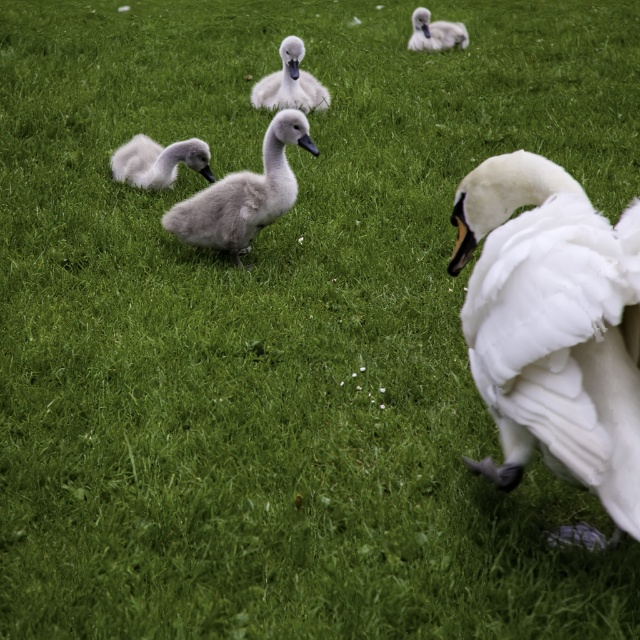
You are standing at the center of the grassy field and see the soft gray swan at upper center. Which direction should you move to get closer to it?

The soft gray swan at upper center is located at point 0.052 on the horizontal axis and 0.680 on the vertical axis. Since you are at the center, you should move towards the upper left direction to get closer to the swan.

You are a birdwatcher observing the swans in the image. You notice the soft gray swan at upper center and the gray matte beak at center. Which object is positioned higher in the image?

The soft gray swan at upper center is positioned higher than the gray matte beak at center in the image.

You are a nature photographer aiming to capture the soft gray swan at upper center and the black glossy beak at center in a single shot. Based on their positions, can you determine which object is closer to the camera?

The black glossy beak at center is closer to the camera because the soft gray swan at upper center is positioned over it, indicating that the beak is in front spatially.